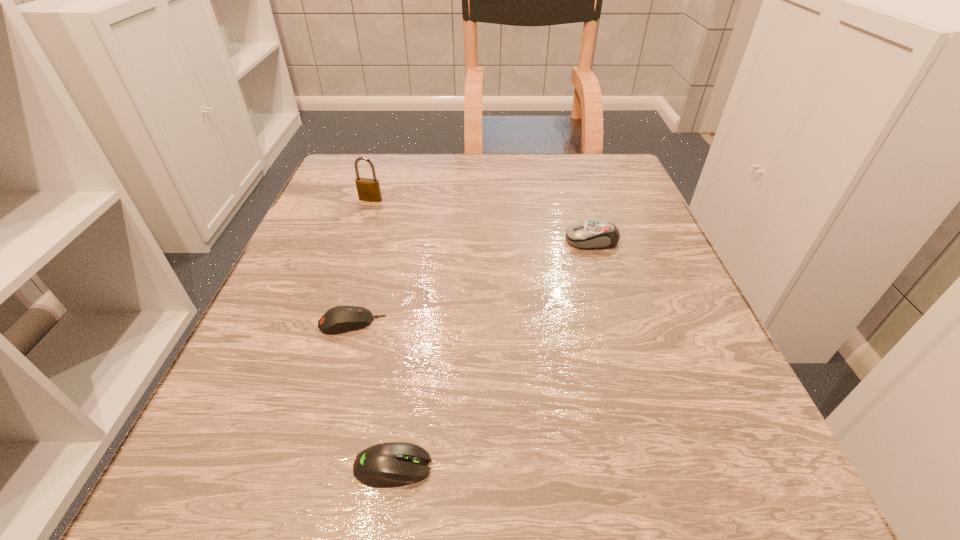
Point out which computer mouse is positioned as the second nearest to the third shortest object. Please provide its 2D coordinates. Your answer should be formatted as a tuple, i.e. [(x, y)], where the tuple contains the x and y coordinates of a point satisfying the conditions above.

[(393, 464)]

Locate an element on the screen. the second closest computer mouse to the nearest object is located at coordinates (595, 234).

At what (x,y) coordinates should I click in order to perform the action: click on vacant space that satisfies the following two spatial constraints: 1. on the wheel side of the farthest computer mouse; 2. on the front side of the leftmost computer mouse. Please return your answer as a coordinate pair (x, y). This screenshot has height=540, width=960. Looking at the image, I should click on (617, 323).